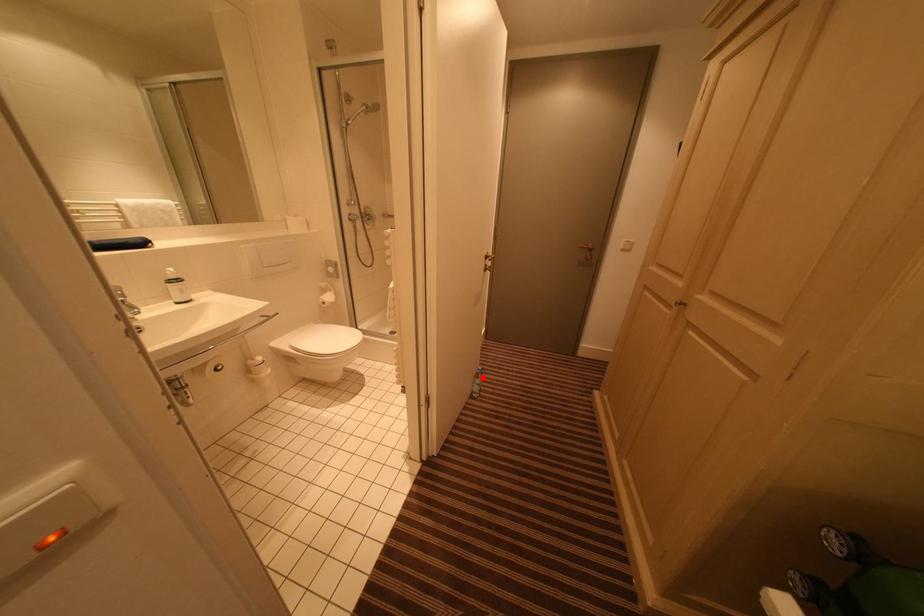
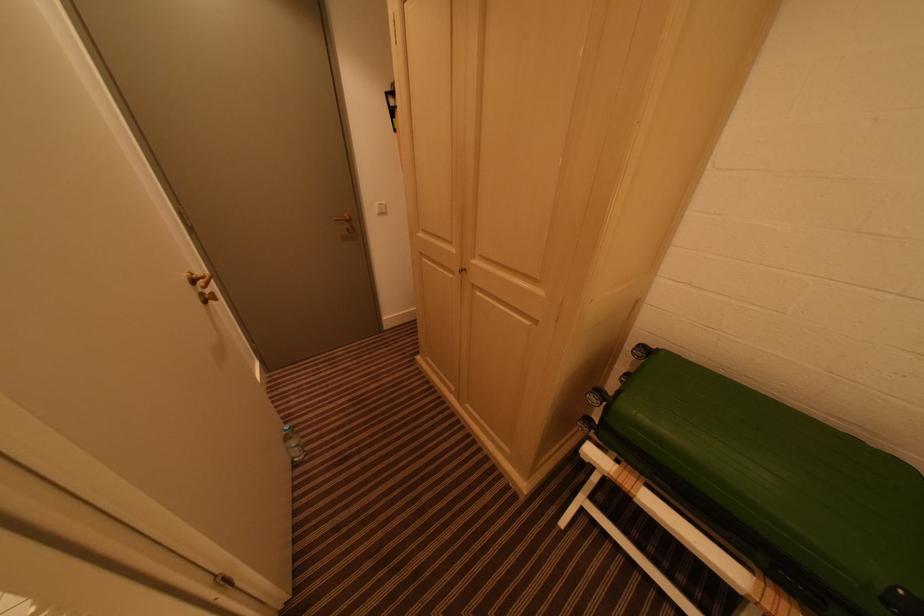
Find the pixel in the second image that matches the highlighted location in the first image.

(293, 440)